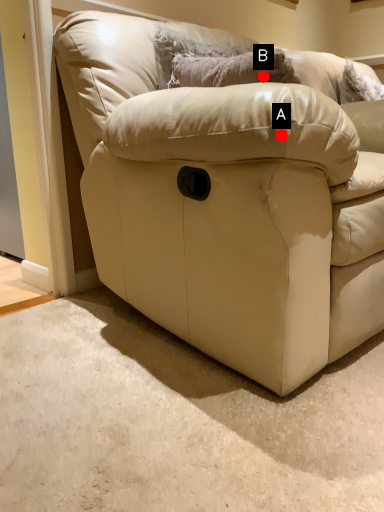
Question: Two points are circled on the image, labeled by A and B beside each circle. Which point appears closest to the camera in this image?

Choices:
 (A) A is closer
 (B) B is closer

Answer: (A)